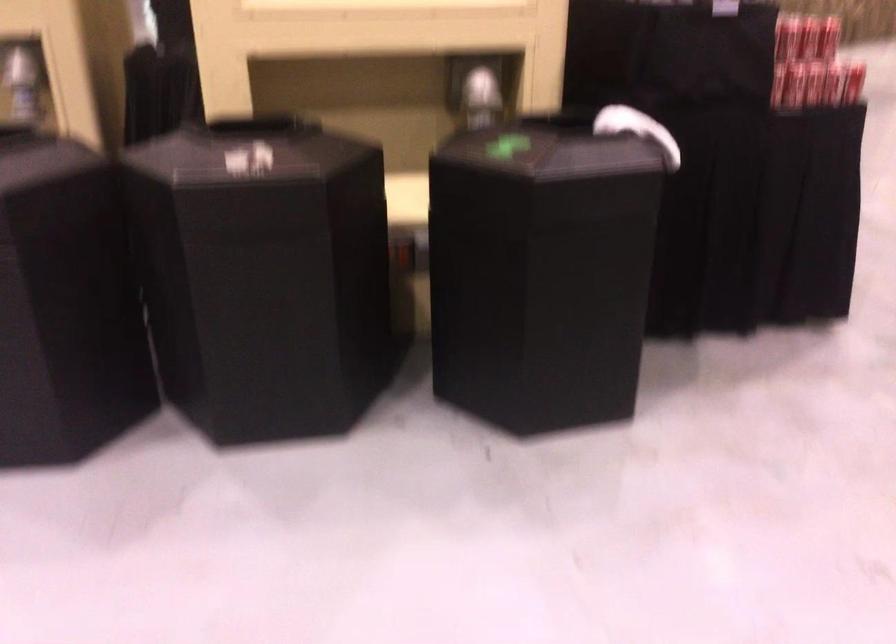
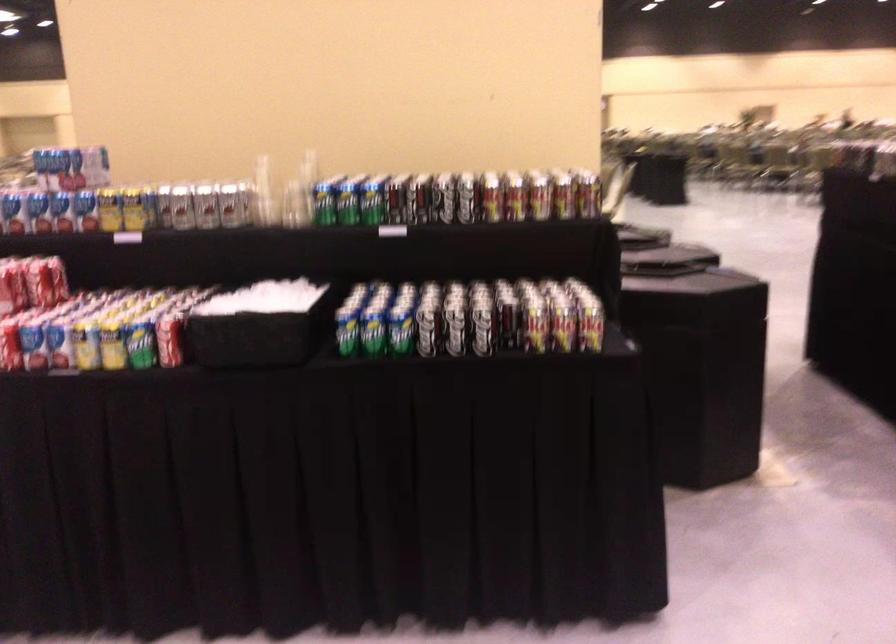
Question: I am providing you with two images of the same scene from different viewpoints. Please identify which objects are invisible in image2.

Choices:
 (A) headboard light switch
 (B) black trash can lid
 (C) yellow soda can
 (D) blue soda can

Answer: (B)